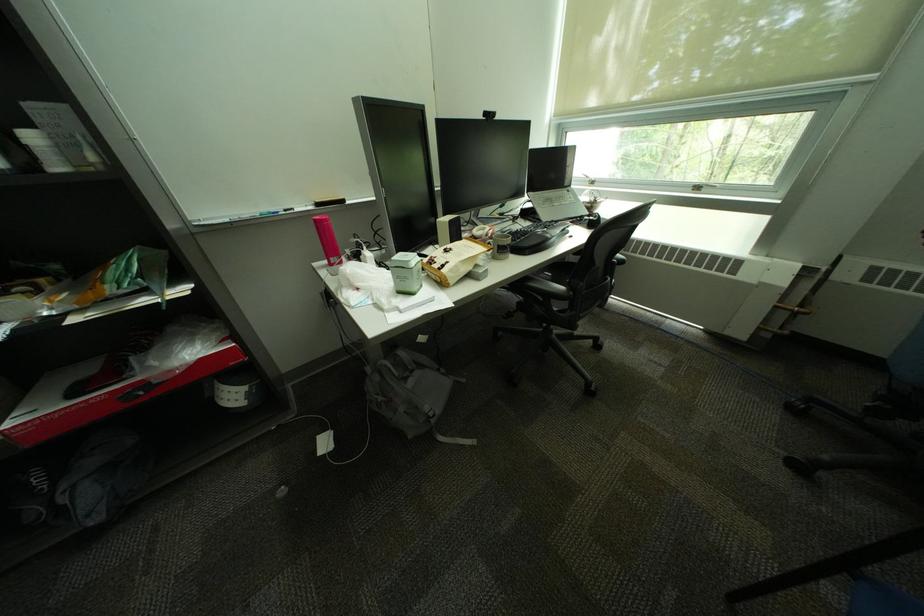
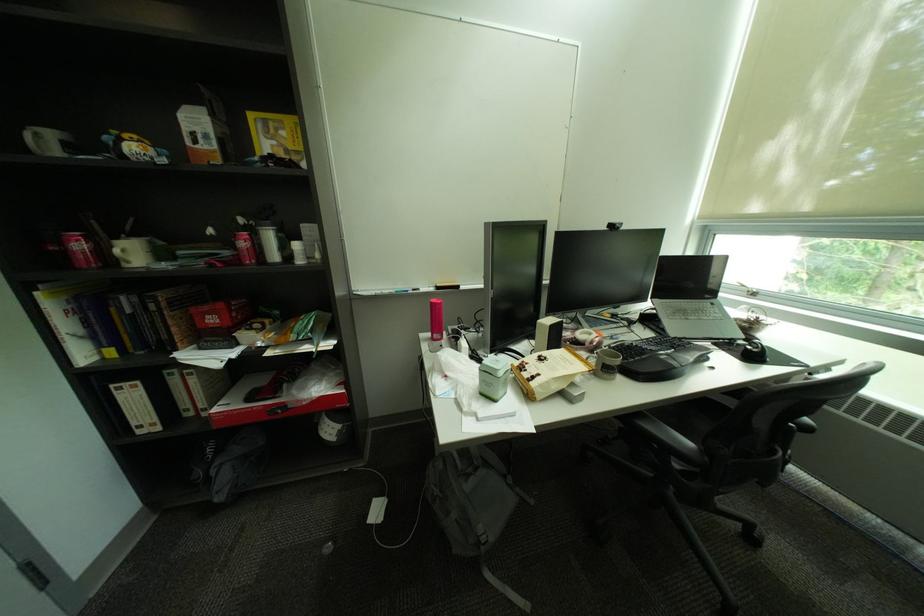
In the second image, find the point that corresponds to point 323,265 in the first image.

(431, 334)